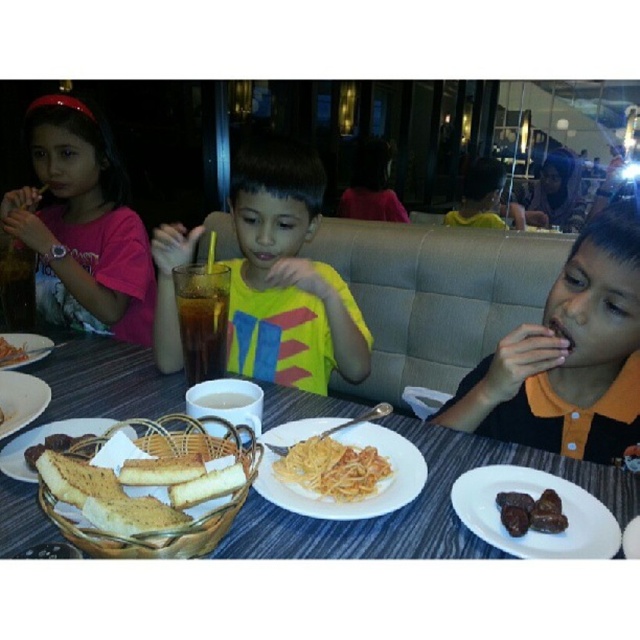
You are a waiter in a restaurant and need to place a new order of drinks on the table. The drinks must be placed between the breadcrustybasket at lower left and the dark brown glossy dates at lower right. Can you place them there without moving either object?

The breadcrustybasket at lower left is in front of the dark brown glossy dates at lower right, so there is space between them where the drinks can be placed without moving either object.

You are a server at the restaurant and need to place a new dish on the table. The dish must be placed to the right of the white matte plate at center. Where should you place it in relation to the dark brown glossy dates at lower right?

The dish should be placed to the right of the white matte plate at center, which would place it to the right of the dark brown glossy dates at lower right since the white matte plate at center is to the left of the dark brown glossy dates at lower right.

Based on the photo, you are a photographer trying to capture a candid shot of the pink fabric shirt at upper left and the white matte plate at center. Since you want to ensure both are in focus, you need to know their relative sizes. Which object is bigger?

The pink fabric shirt at upper left is larger in size than the white matte plate at center, so the photographer should focus on the pink fabric shirt at upper left first as it requires more attention due to its larger size.